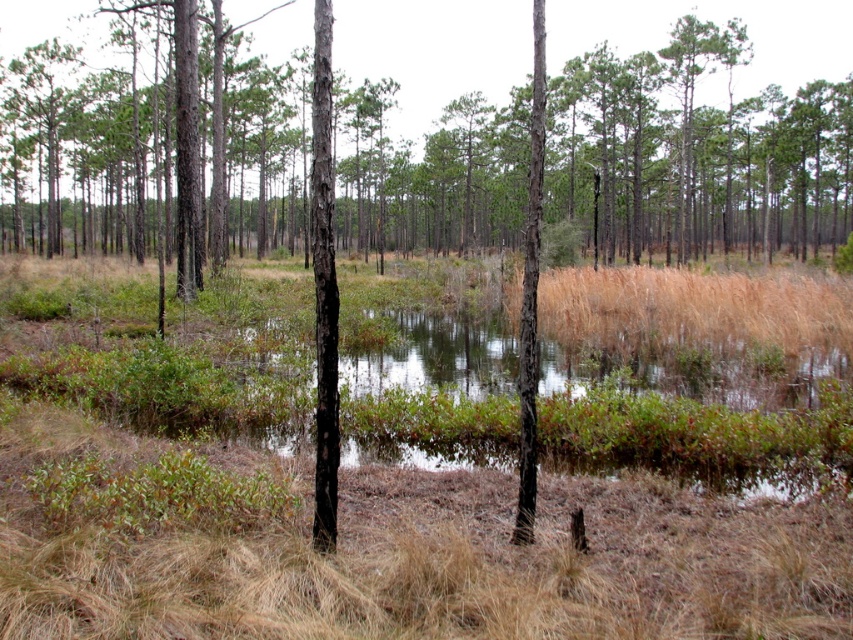
Based on the photo, you are standing in the wetland and want to take a photo of both the green bark tree at center and the smooth bark tree at center. Which tree should you focus on first to ensure both are in clear view?

You should focus on the green bark tree at center first because it is closer to you than the smooth bark tree at center, allowing both to be in focus when adjusting the camera settings.

You are standing in the wetland scene and want to walk from the point at coordinates point (97,136) to the point at coordinates point (534,369). Which direction should you move relative to your current position?

You should move forward because point (97,136) is behind point (534,369), meaning the destination is in front of your current position.